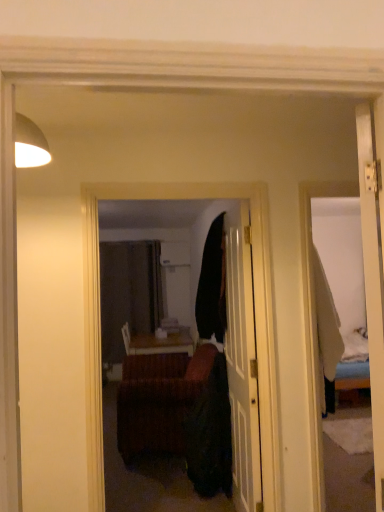
Question: Looking at the image, does matte black mirror at center seem bigger or smaller compared to woven wood table at center?

Choices:
 (A) big
 (B) small

Answer: (B)

Question: Is point (192, 267) positioned closer to the camera than point (148, 335)?

Choices:
 (A) farther
 (B) closer

Answer: (B)

Question: Considering the real-world distances, which object is closest to the matte black door at center?

Choices:
 (A) brown woven studio couch at center
 (B) woven wood table at center
 (C) matte black mirror at center

Answer: (A)

Question: Estimate the real-world distances between objects in this image. Which object is closer to the matte black door at center?

Choices:
 (A) brown woven studio couch at center
 (B) matte black mirror at center
 (C) woven wood table at center

Answer: (A)